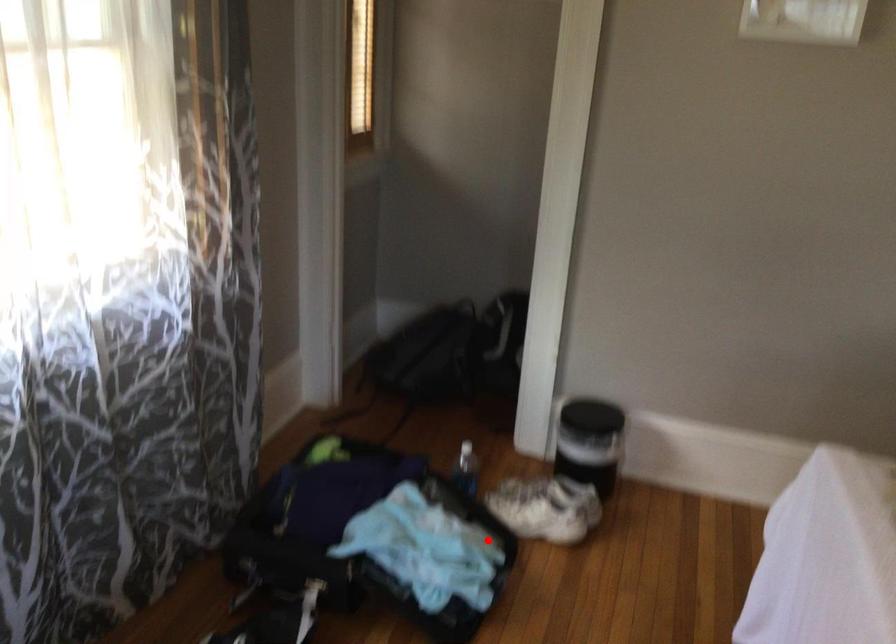
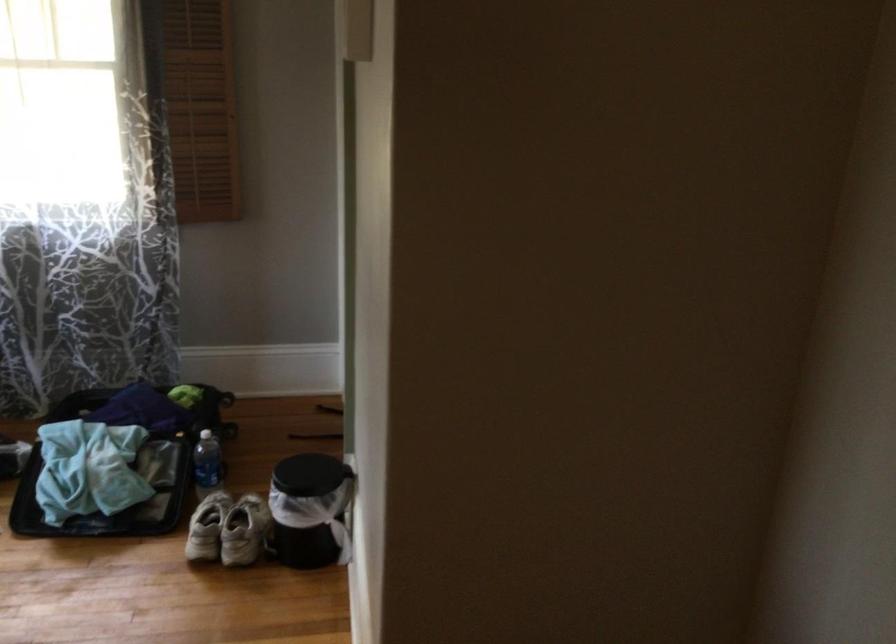
Question: I am providing you with two images of the same scene from different viewpoints. Given a red point in image1, look at the same physical point in image2. Is it:

Choices:
 (A) Closer to the viewpoint
 (B) Farther from the viewpoint

Answer: (B)